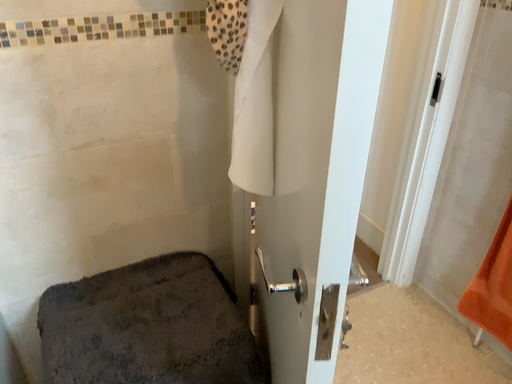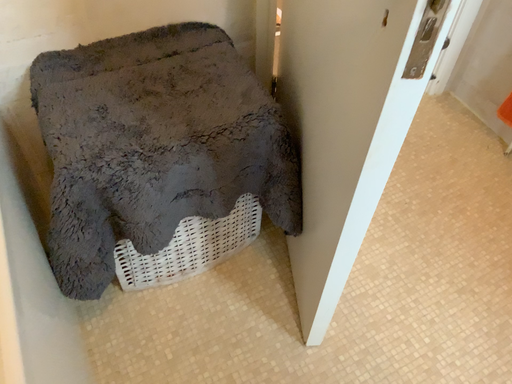
Question: How did the camera likely rotate when shooting the video?

Choices:
 (A) rotated downward
 (B) rotated upward

Answer: (A)